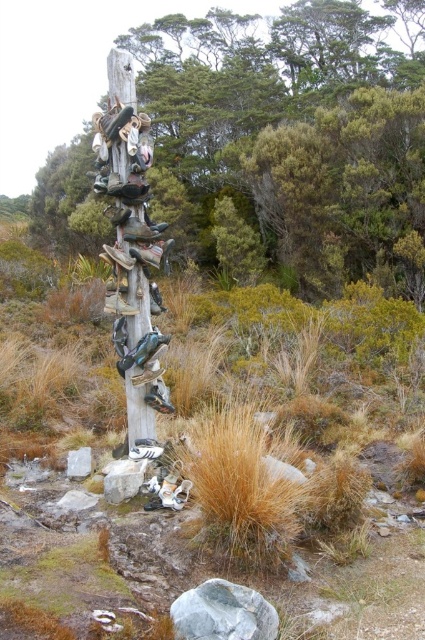
Question: Is wooden totem pole at center to the left of shiny metallic shoes at center from the viewer's perspective?

Choices:
 (A) no
 (B) yes

Answer: (A)

Question: Which of the following is the closest to the observer?

Choices:
 (A) white marble stone at center
 (B) shiny black shoe at center
 (C) matte black shoe at center
 (D) wooden totem pole at center

Answer: (B)

Question: Is shiny metallic shoes at center positioned at the back of shiny black shoe at center?

Choices:
 (A) yes
 (B) no

Answer: (B)

Question: Does wooden totem pole at center have a lesser width compared to gray rock at center?

Choices:
 (A) yes
 (B) no

Answer: (B)

Question: Which object is closer to the camera taking this photo?

Choices:
 (A) white marble stone at center
 (B) gray rock at center
 (C) wooden totem pole at center
 (D) shiny metallic shoes at center

Answer: (B)

Question: Which point is closer to the camera taking this photo?

Choices:
 (A) (357, 60)
 (B) (146, 236)
 (C) (150, 387)

Answer: (B)